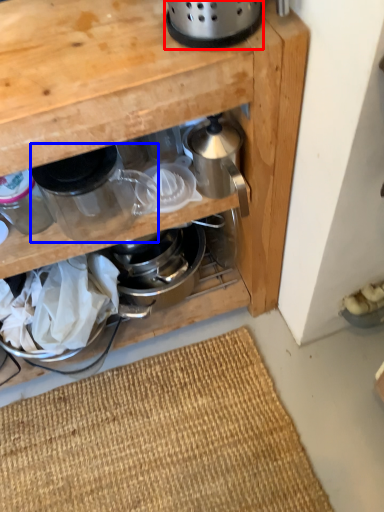
Question: Which point is closer to the camera, appliance (highlighted by a red box) or kitchen appliance (highlighted by a blue box)?

Choices:
 (A) appliance
 (B) kitchen appliance

Answer: (A)